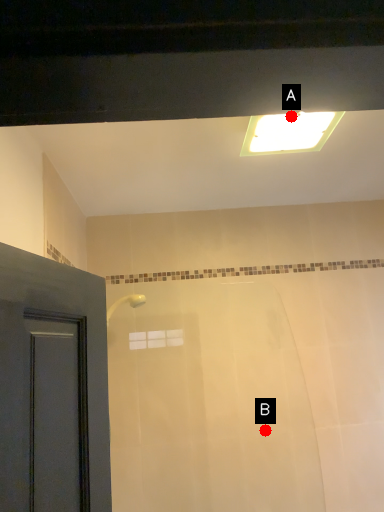
Question: Two points are circled on the image, labeled by A and B beside each circle. Which point appears farthest from the camera in this image?

Choices:
 (A) A is further
 (B) B is further

Answer: (B)